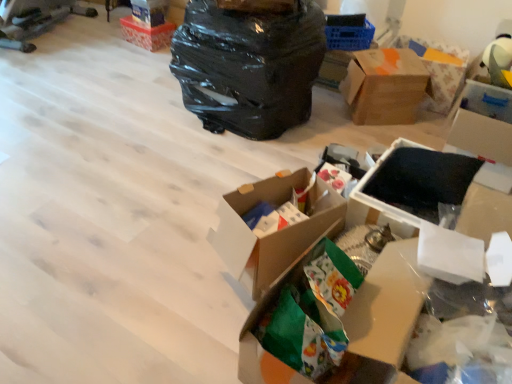
What do you see at coordinates (383, 315) in the screenshot?
I see `green paper bag at center, which is counted as the 3th box, starting from the left` at bounding box center [383, 315].

Locate an element on the screen. Image resolution: width=512 pixels, height=384 pixels. white cardboard box at upper right, which is the 3th box from back to front is located at coordinates (483, 123).

The image size is (512, 384). What do you see at coordinates (483, 123) in the screenshot?
I see `white cardboard box at upper right, positioned as the third box in top-to-bottom order` at bounding box center [483, 123].

This screenshot has width=512, height=384. Identify the location of orange-patterned cardboard box at upper right. (438, 70).

Measure the distance between point (286, 231) and camera.

Point (286, 231) and camera are 5.11 feet apart.

The width and height of the screenshot is (512, 384). I want to click on cardboard box at center, which appears as the 2th box when viewed from the left, so click(272, 233).

What are the coordinates of `black matte storage box at upper right, marked as the 4th storage box in a left-to-right arrangement` in the screenshot? It's located at (484, 147).

In the image, is orange-patterned cardboard box at upper right on the left side or the right side of cardboard box at center, the fourth box when ordered from back to front?

orange-patterned cardboard box at upper right is to the right of cardboard box at center, the fourth box when ordered from back to front.

From a real-world perspective, who is located higher, orange-patterned cardboard box at upper right or cardboard box at center, which appears as the 2th box when viewed from the left?

In real-world perspective, orange-patterned cardboard box at upper right is above.

Who is bigger, orange-patterned cardboard box at upper right or cardboard box at center, the fourth box when ordered from back to front?

Bigger between the two is orange-patterned cardboard box at upper right.

From the picture: Is white paper at lower right, the first storage box from the front, completely or partially outside of matte plastic storage box at upper center, the 1th storage box from the back?

white paper at lower right, the first storage box from the front, lies outside matte plastic storage box at upper center, the 1th storage box from the back,'s area.

Based on their sizes in the image, would you say white paper at lower right, the 1th storage box in the bottom-to-top sequence, is bigger or smaller than matte plastic storage box at upper center, marked as the 1th storage box in a left-to-right arrangement?

Clearly, white paper at lower right, the 1th storage box in the bottom-to-top sequence, is larger in size than matte plastic storage box at upper center, marked as the 1th storage box in a left-to-right arrangement.

Is white paper at lower right, acting as the 3th storage box starting from the right, taller than matte plastic storage box at upper center, arranged as the first storage box when viewed from the top?

Yes, white paper at lower right, acting as the 3th storage box starting from the right, is taller than matte plastic storage box at upper center, arranged as the first storage box when viewed from the top.

Find the location of `box behind the brown cardboard box at upper right, which appears as the second box when viewed from the top`. box behind the brown cardboard box at upper right, which appears as the second box when viewed from the top is located at coordinates (147, 34).

Would you say brown cardboard box at upper right, the fourth box positioned from the left, contains orange cardboard box at upper left, the first box from the left?

No, orange cardboard box at upper left, the first box from the left, is not inside brown cardboard box at upper right, the fourth box positioned from the left.

Can you confirm if brown cardboard box at upper right, which appears as the second box when viewed from the top, is taller than orange cardboard box at upper left, the first box in the back-to-front sequence?

Yes, brown cardboard box at upper right, which appears as the second box when viewed from the top, is taller than orange cardboard box at upper left, the first box in the back-to-front sequence.

Is brown cardboard box at upper right, the 4th box ordered from the bottom, wider or thinner than orange cardboard box at upper left, the first box from the left?

Considering their sizes, brown cardboard box at upper right, the 4th box ordered from the bottom, looks broader than orange cardboard box at upper left, the first box from the left.

Is white cardboard box at upper right, arranged as the third box when ordered from the bottom, closer to camera compared to black foam at center, the 2th storage box viewed from the right?

No, white cardboard box at upper right, arranged as the third box when ordered from the bottom, is further to the viewer.

Between white cardboard box at upper right, the 3th box from the front, and black foam at center, the 3th storage box from the left, which one has smaller size?

With smaller size is black foam at center, the 3th storage box from the left.

Based on the photo, considering the sizes of objects white cardboard box at upper right, arranged as the third box when ordered from the bottom, and black foam at center, the 2th storage box in the bottom-to-top sequence, in the image provided, who is taller, white cardboard box at upper right, arranged as the third box when ordered from the bottom, or black foam at center, the 2th storage box in the bottom-to-top sequence,?

Standing taller between the two is white cardboard box at upper right, arranged as the third box when ordered from the bottom.

Is white cardboard box at upper right, positioned as the third box in top-to-bottom order, facing towards black foam at center, which appears as the third storage box when viewed from the top?

Yes, white cardboard box at upper right, positioned as the third box in top-to-bottom order, faces towards black foam at center, which appears as the third storage box when viewed from the top.

From the picture: Does orange cardboard box at upper left, the first box in the back-to-front sequence, appear on the right side of white paper at lower right, the 1th storage box in the bottom-to-top sequence?

Incorrect, orange cardboard box at upper left, the first box in the back-to-front sequence, is not on the right side of white paper at lower right, the 1th storage box in the bottom-to-top sequence.

Is there a large distance between orange cardboard box at upper left, which ranks as the first box in top-to-bottom order, and white paper at lower right, the 1th storage box in the bottom-to-top sequence?

Indeed, orange cardboard box at upper left, which ranks as the first box in top-to-bottom order, is not near white paper at lower right, the 1th storage box in the bottom-to-top sequence.

How different are the orientations of white paper at lower right, the first storage box from the front, and black foam at center, the second storage box when ordered from front to back, in degrees?

The facing directions of white paper at lower right, the first storage box from the front, and black foam at center, the second storage box when ordered from front to back, are 4.76 degrees apart.

How far apart are white paper at lower right, which ranks as the fourth storage box in back-to-front order, and black foam at center, the 2th storage box viewed from the right?

white paper at lower right, which ranks as the fourth storage box in back-to-front order, and black foam at center, the 2th storage box viewed from the right, are 13.69 inches apart.

Does white paper at lower right, acting as the 3th storage box starting from the right, touch black foam at center, which appears as the third storage box when viewed from the top?

No, white paper at lower right, acting as the 3th storage box starting from the right, is not beside black foam at center, which appears as the third storage box when viewed from the top.

Does white paper at lower right, acting as the 3th storage box starting from the right, turn towards black foam at center, the 2th storage box in the bottom-to-top sequence?

No, white paper at lower right, acting as the 3th storage box starting from the right, is not facing towards black foam at center, the 2th storage box in the bottom-to-top sequence.

Considering the sizes of brown cardboard box at upper right, which appears as the second box when viewed from the top, and cardboard box at center, positioned as the fourth box in right-to-left order, in the image, is brown cardboard box at upper right, which appears as the second box when viewed from the top, wider or thinner than cardboard box at center, positioned as the fourth box in right-to-left order,?

In the image, brown cardboard box at upper right, which appears as the second box when viewed from the top, appears to be wider than cardboard box at center, positioned as the fourth box in right-to-left order.

Is brown cardboard box at upper right, the 2th box when ordered from back to front, facing towards cardboard box at center, the fourth box viewed from the top?

No, brown cardboard box at upper right, the 2th box when ordered from back to front, is not aimed at cardboard box at center, the fourth box viewed from the top.

How distant is brown cardboard box at upper right, the 2th box when ordered from back to front, from cardboard box at center, the 2th box from the bottom?

A distance of 4.30 feet exists between brown cardboard box at upper right, the 2th box when ordered from back to front, and cardboard box at center, the 2th box from the bottom.

Between brown cardboard box at upper right, the 2th box when ordered from back to front, and cardboard box at center, the 2th box from the front, which one appears on the left side from the viewer's perspective?

cardboard box at center, the 2th box from the front, is more to the left.

What are the coordinates of `cardboard box above the cardboard box at center, the 2th box from the front (from the image's perspective)` in the screenshot? It's located at (438, 70).

This screenshot has width=512, height=384. I want to click on storage box that is the 3rd object located below the matte plastic storage box at upper center, the fourth storage box in the right-to-left sequence (from the image's perspective), so click(x=387, y=305).

Considering their positions, is matte plastic storage box at upper center, marked as the 1th storage box in a left-to-right arrangement, positioned closer to cardboard box at center, which appears as the 2th box when viewed from the left, than green paper bag at center, the 1th box in the front-to-back sequence?

green paper bag at center, the 1th box in the front-to-back sequence, is positioned closer to the anchor cardboard box at center, which appears as the 2th box when viewed from the left.

Looking at the image, which one is located further to black plastic bag at upper center, black matte storage box at upper right, the 3th storage box in the front-to-back sequence, or black foam at center, the 3th storage box from the left?

black matte storage box at upper right, the 3th storage box in the front-to-back sequence, is positioned further to the anchor black plastic bag at upper center.

Considering their positions, is black foam at center, the 2th storage box in the bottom-to-top sequence, positioned further to green paper bag at center, which is the 3th box from right to left, than white paper at lower right, arranged as the 4th storage box when viewed from the top?

black foam at center, the 2th storage box in the bottom-to-top sequence.

Estimate the real-world distances between objects in this image. Which object is further from cardboard box at center, positioned as the fourth box in right-to-left order, black foam at center, which appears as the third storage box when viewed from the top, or brown cardboard box at upper right, which appears as the second box when viewed from the top?

A: brown cardboard box at upper right, which appears as the second box when viewed from the top, is further to cardboard box at center, positioned as the fourth box in right-to-left order.

Estimate the real-world distances between objects in this image. Which object is closer to brown cardboard box at upper right, positioned as the fourth box in front-to-back order, matte plastic storage box at upper center, the 1th storage box from the back, or black matte storage box at upper right, which appears as the third storage box when ordered from the bottom?

Among the two, black matte storage box at upper right, which appears as the third storage box when ordered from the bottom, is located nearer to brown cardboard box at upper right, positioned as the fourth box in front-to-back order.

Considering their positions, is white cardboard box at upper right, which is the 3th box from back to front, positioned closer to black matte storage box at upper right, the 3th storage box in the front-to-back sequence, than brown cardboard box at upper right, positioned as the fourth box in front-to-back order?

Based on the image, white cardboard box at upper right, which is the 3th box from back to front, appears to be nearer to black matte storage box at upper right, the 3th storage box in the front-to-back sequence.

Based on their spatial positions, is black matte storage box at upper right, which appears as the third storage box when ordered from the bottom, or black foam at center, the 2th storage box viewed from the right, further from cardboard box at center, which appears as the 2th box when viewed from the left?

The object further to cardboard box at center, which appears as the 2th box when viewed from the left, is black matte storage box at upper right, which appears as the third storage box when ordered from the bottom.

When comparing their distances from black matte storage box at upper right, positioned as the first storage box in right-to-left order, does orange-patterned cardboard box at upper right or cardboard box at center, the 2th box from the front, seem closer?

orange-patterned cardboard box at upper right lies closer to black matte storage box at upper right, positioned as the first storage box in right-to-left order, than the other object.

Where is `plastic bag between orange cardboard box at upper left, arranged as the 5th box when ordered from the bottom, and orange-patterned cardboard box at upper right, in the horizontal direction`? The height and width of the screenshot is (384, 512). plastic bag between orange cardboard box at upper left, arranged as the 5th box when ordered from the bottom, and orange-patterned cardboard box at upper right, in the horizontal direction is located at coordinates (249, 63).

The height and width of the screenshot is (384, 512). I want to click on plastic bag between matte plastic storage box at upper center, arranged as the first storage box when viewed from the top, and black matte storage box at upper right, the 3th storage box in the front-to-back sequence, from left to right, so click(x=249, y=63).

Locate an element on the screen. Image resolution: width=512 pixels, height=384 pixels. plastic bag situated between matte plastic storage box at upper center, marked as the 1th storage box in a left-to-right arrangement, and brown cardboard box at upper right, the fourth box positioned from the left, from left to right is located at coordinates (249, 63).

The width and height of the screenshot is (512, 384). In order to click on plastic bag between white paper at lower right, which ranks as the fourth storage box in back-to-front order, and white cardboard box at upper right, the 3th box from the front, in the front-back direction in this screenshot , I will do `click(249, 63)`.